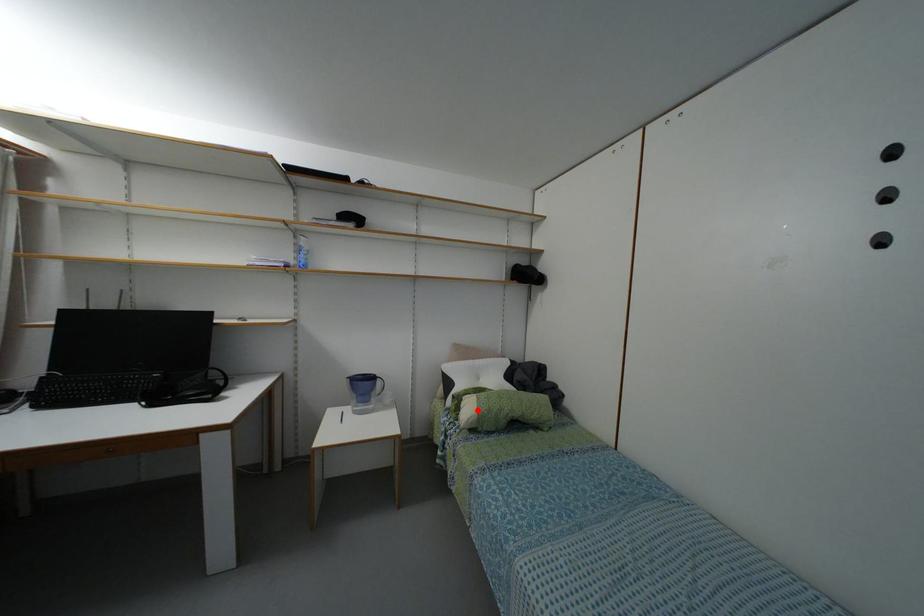
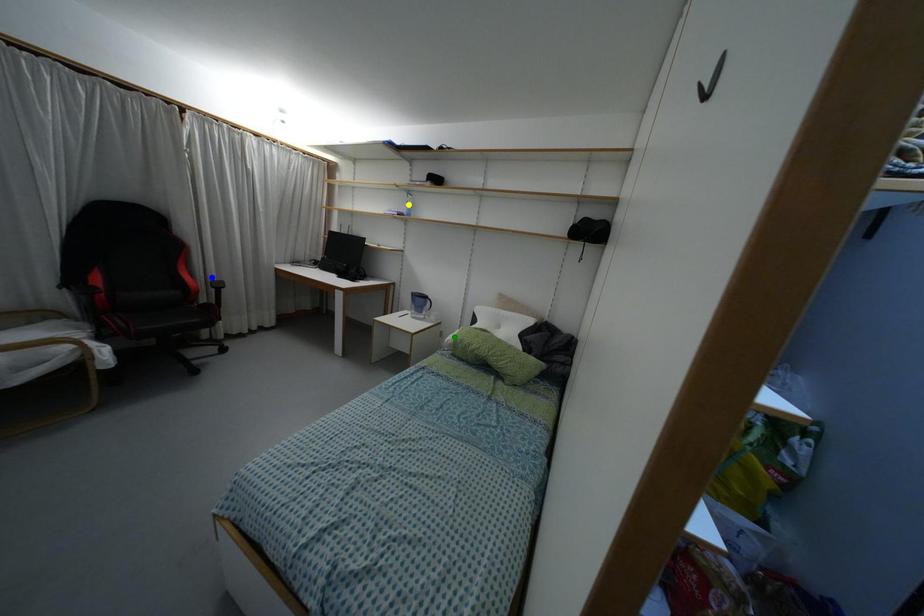
Question: I am providing you with two images of the same scene from different viewpoints. A red point is marked on the first image. You are given multiple points on the second image. In image 2, which mark is for the same physical point as the one in image 1?

Choices:
 (A) yellow point
 (B) green point
 (C) blue point

Answer: (B)